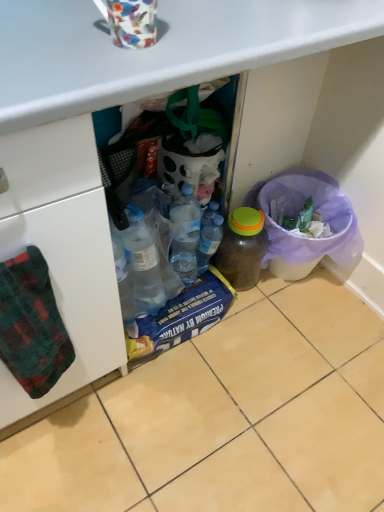
This screenshot has width=384, height=512. In order to click on unoccupied region to the right of floral-patterned ceramic mug at upper center in this screenshot , I will do point(221,36).